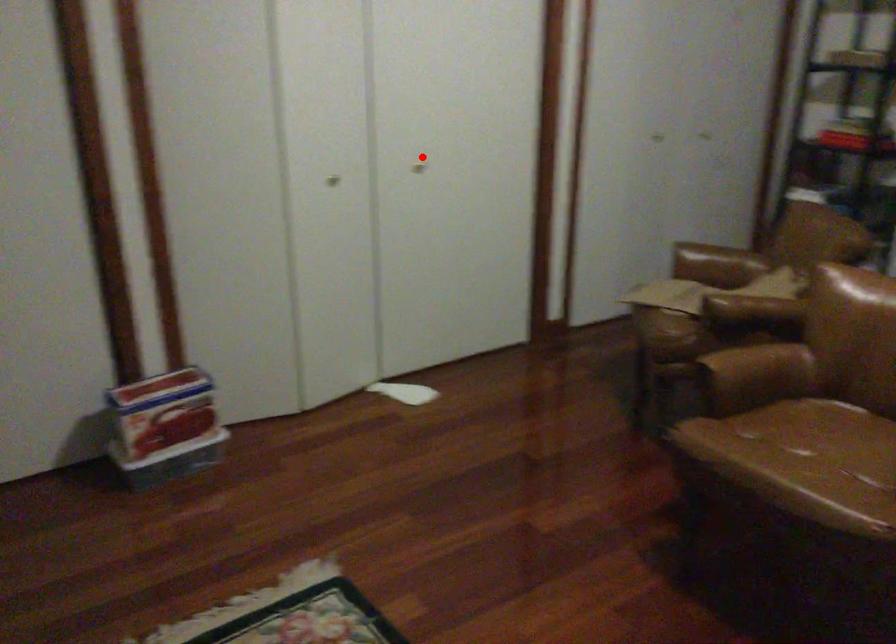
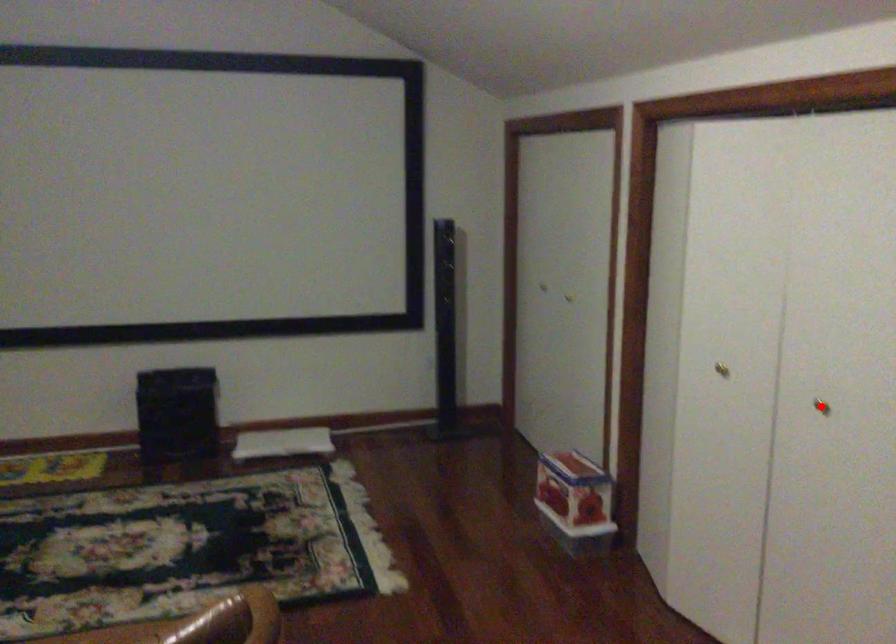
I am providing you with two images of the same scene from different viewpoints. A red point is marked on the first image and another point is marked on the second image. Does the point marked in image1 correspond to the same location as the one in image2?

Yes